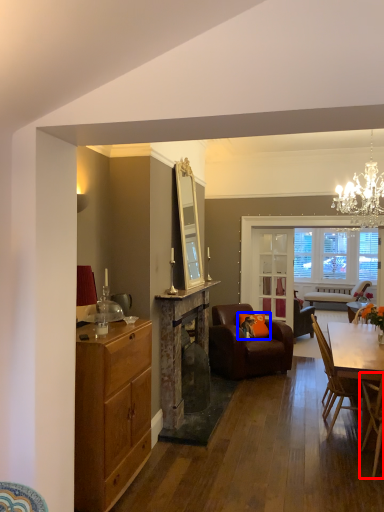
Question: Among these objects, which one is nearest to the camera, chair (highlighted by a red box) or pillow (highlighted by a blue box)?

Choices:
 (A) chair
 (B) pillow

Answer: (A)